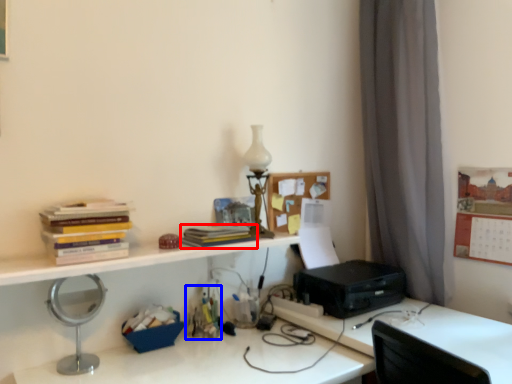
Question: Which of the following is the farthest to the observer, paperback book (highlighted by a red box) or stationery (highlighted by a blue box)?

Choices:
 (A) paperback book
 (B) stationery

Answer: (B)